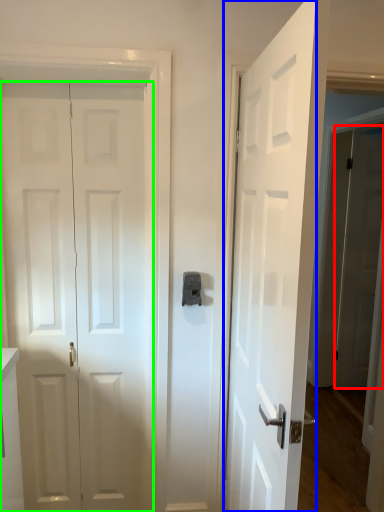
Question: Based on their relative distances, which object is nearer to door (highlighted by a red box)? Choose from door (highlighted by a blue box) and door (highlighted by a green box).

Choices:
 (A) door
 (B) door

Answer: (A)